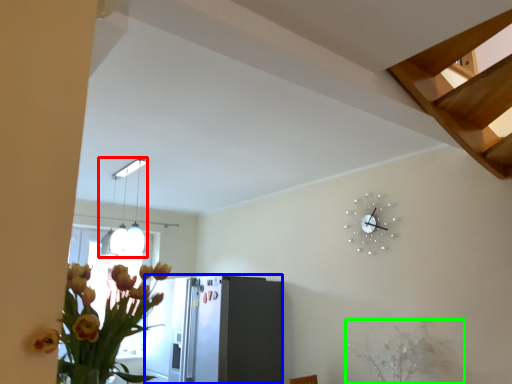
Question: Which is farther away from lamp (highlighted by a red box)? appliance (highlighted by a blue box) or plant (highlighted by a green box)?

Choices:
 (A) appliance
 (B) plant

Answer: (B)